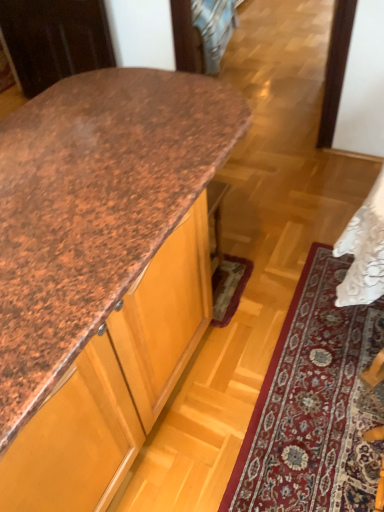
Identify the location of vacant space underneath carpet with intricate patterns at lower right (from a real-world perspective). This screenshot has width=384, height=512. (312, 414).